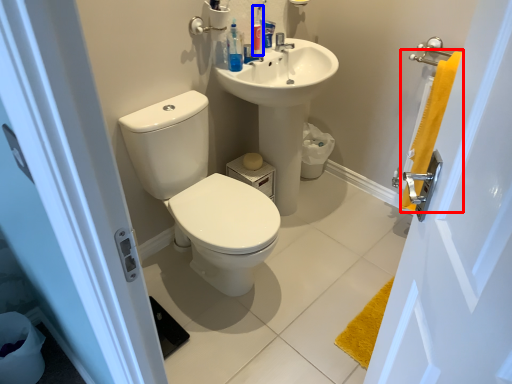
Question: Among these objects, which one is nearest to the camera, bath towel (highlighted by a red box) or toiletry (highlighted by a blue box)?

Choices:
 (A) bath towel
 (B) toiletry

Answer: (A)